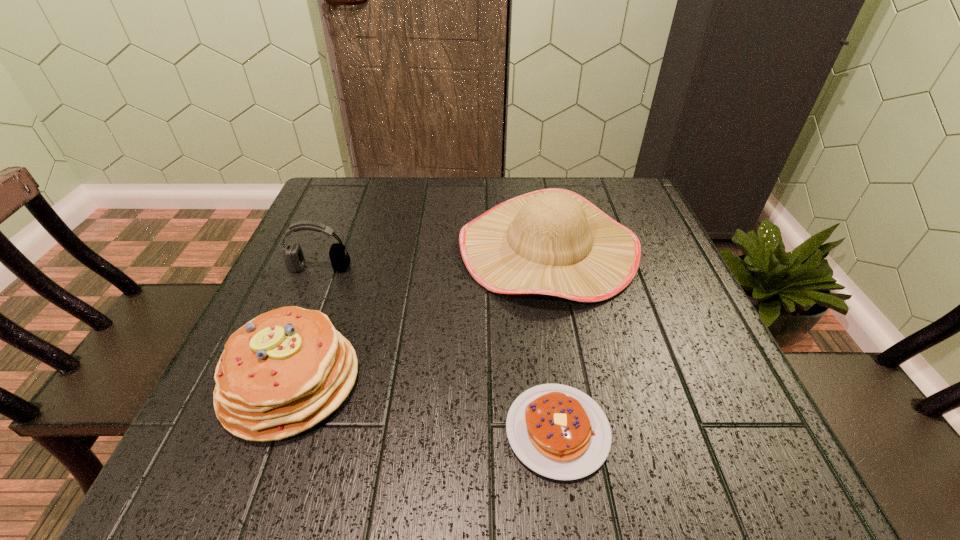
You are a GUI agent. You are given a task and a screenshot of the screen. Output one action in this format:
    pyautogui.click(x=<x>, y=<y>)
    Task: Click on the sunhat
    
    Given the screenshot: What is the action you would take?
    pyautogui.click(x=553, y=241)

This screenshot has width=960, height=540. I want to click on headset, so click(294, 258).

Locate an element on the screen. the taller pancake is located at coordinates (283, 372).

Where is `the shortest object`? The height and width of the screenshot is (540, 960). the shortest object is located at coordinates (558, 431).

Locate an element on the screen. the shorter pancake is located at coordinates (558, 431).

Where is `free space located on the front of the sunhat`? free space located on the front of the sunhat is located at coordinates (565, 342).

Image resolution: width=960 pixels, height=540 pixels. Find the location of `blank area located 0.180m on the headband of the headset`. blank area located 0.180m on the headband of the headset is located at coordinates (292, 337).

This screenshot has width=960, height=540. In order to click on blank area located 0.230m on the right of the left pancake in this screenshot , I will do `click(492, 382)`.

Locate an element on the screen. This screenshot has height=540, width=960. free space located on the left of the shortest object is located at coordinates (429, 431).

I want to click on object that is positioned at the far edge, so click(553, 241).